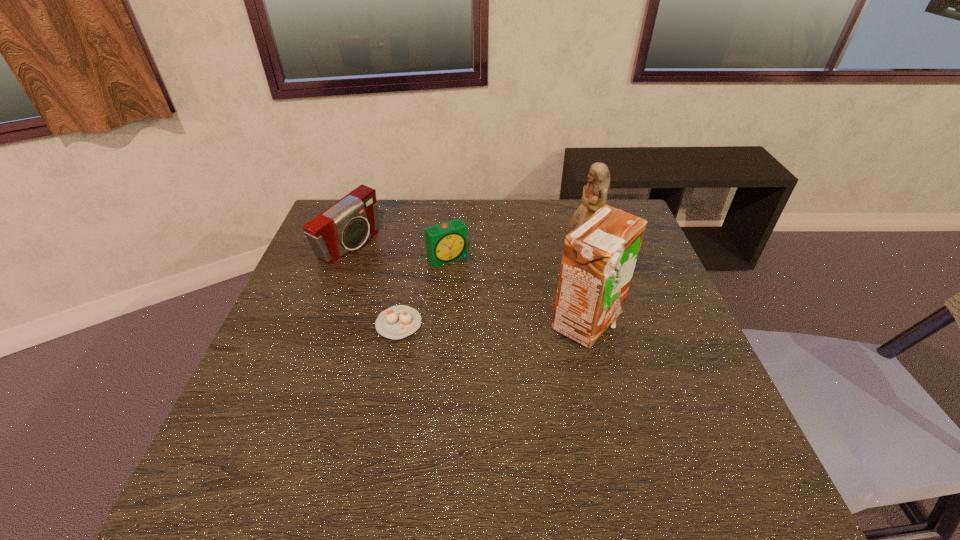
This screenshot has width=960, height=540. What are the coordinates of `vacant region between the fourth tallest object and the carton` in the screenshot? It's located at (517, 291).

This screenshot has height=540, width=960. Identify the location of free spot between the cupcake and the figurine. (490, 287).

Image resolution: width=960 pixels, height=540 pixels. Identify the location of free spot between the shortest object and the figurine. (490, 287).

You are a GUI agent. You are given a task and a screenshot of the screen. Output one action in this format:
    pyautogui.click(x=<x>, y=<y>)
    Task: Click on the vacant space that's between the carton and the cupcake
    The image size is (960, 540).
    Given the screenshot: What is the action you would take?
    pyautogui.click(x=492, y=324)

The image size is (960, 540). What are the coordinates of `empty space that is in between the figurine and the cupcake` in the screenshot? It's located at (490, 287).

Find the location of `free area in between the carton and the shortest object`. free area in between the carton and the shortest object is located at coordinates (492, 324).

Select which object appears as the third closest to the fourth tallest object. Please provide its 2D coordinates. Your answer should be formatted as a tuple, i.e. [(x, y)], where the tuple contains the x and y coordinates of a point satisfying the conditions above.

[(599, 257)]

The height and width of the screenshot is (540, 960). Find the location of `object that stands as the closest to the camera`. object that stands as the closest to the camera is located at coordinates (446, 242).

Where is `blank space that satisfies the following two spatial constraints: 1. on the front side of the figurine; 2. on the left side of the leftmost object`? blank space that satisfies the following two spatial constraints: 1. on the front side of the figurine; 2. on the left side of the leftmost object is located at coordinates (348, 250).

This screenshot has height=540, width=960. I want to click on vacant position in the image that satisfies the following two spatial constraints: 1. on the back side of the figurine; 2. on the right side of the alarm clock, so click(448, 250).